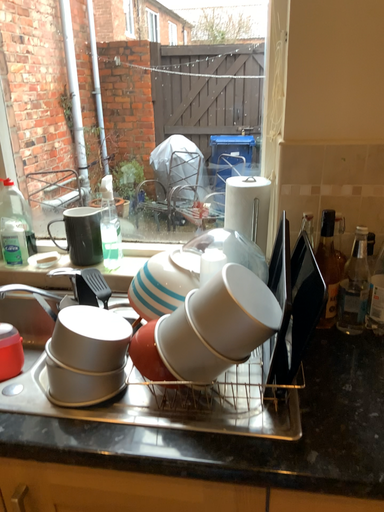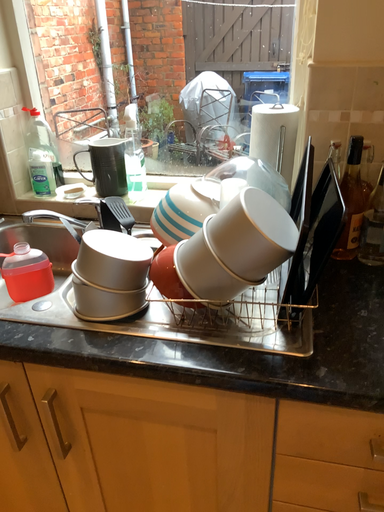
Question: How did the camera likely rotate when shooting the video?

Choices:
 (A) rotated upward
 (B) rotated downward

Answer: (B)